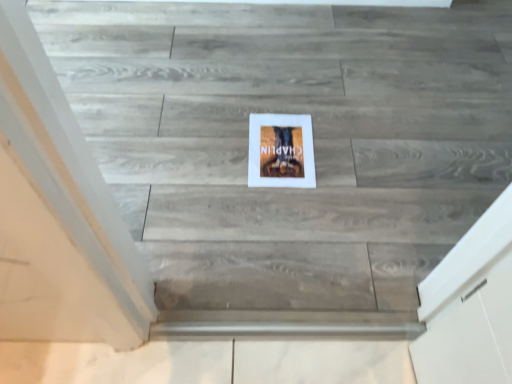
Identify the location of free spot above white matte picture frame at center (from a real-world perspective). The image size is (512, 384). (275, 144).